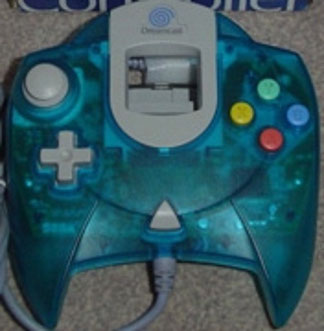
The height and width of the screenshot is (331, 324). I want to click on rug, so click(190, 293).